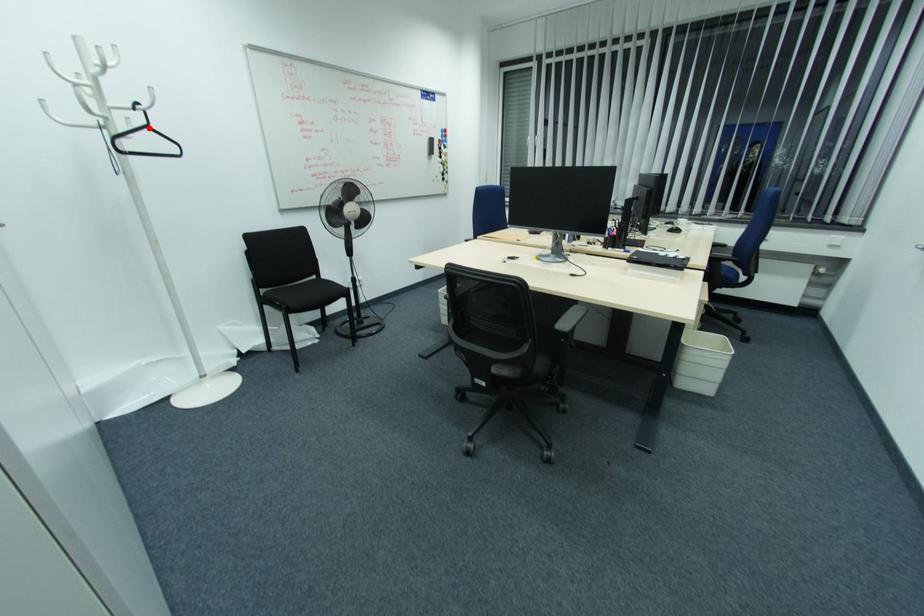
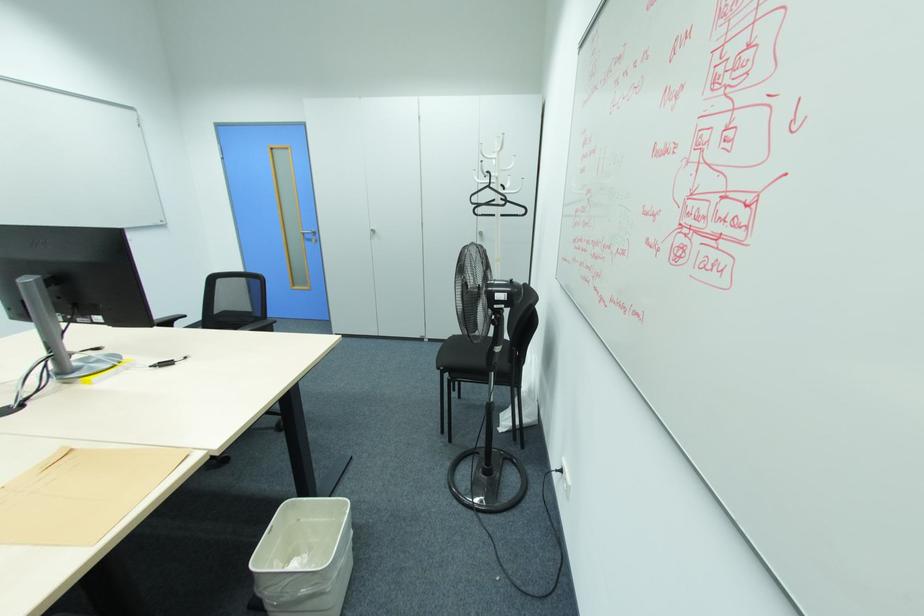
The point at the highlighted location is marked in the first image. Where is the corresponding point in the second image?

(490, 187)